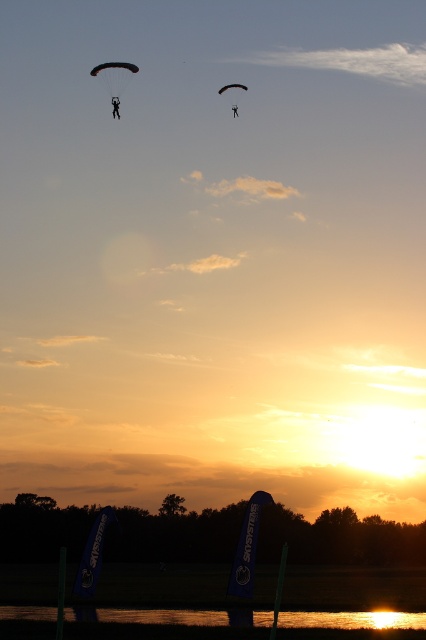
You are a photographer trying to capture the sunset scene. You notice two paragliders, the black matte parachute at upper left and the black fabric parachute at upper center. Which paraglider should you focus on if you want to capture the wider one?

The black matte parachute at upper left is wider than the black fabric parachute at upper center, so you should focus on the black matte parachute at upper left to capture the wider one.

You are a photographer trying to capture the sunset. You notice the glistening water at lower center and the black matte parachute at upper left in your viewfinder. Which object appears wider in the frame?

The black matte parachute at upper left appears wider in the frame because its width is greater than the glistening water at lower center.

Looking at this image, you are an observer looking at the sunset scene. You notice the glistening water at lower center and the black matte parachute at upper left. Which object is positioned to the right of the other?

The glistening water at lower center is positioned to the right of the black matte parachute at upper left.